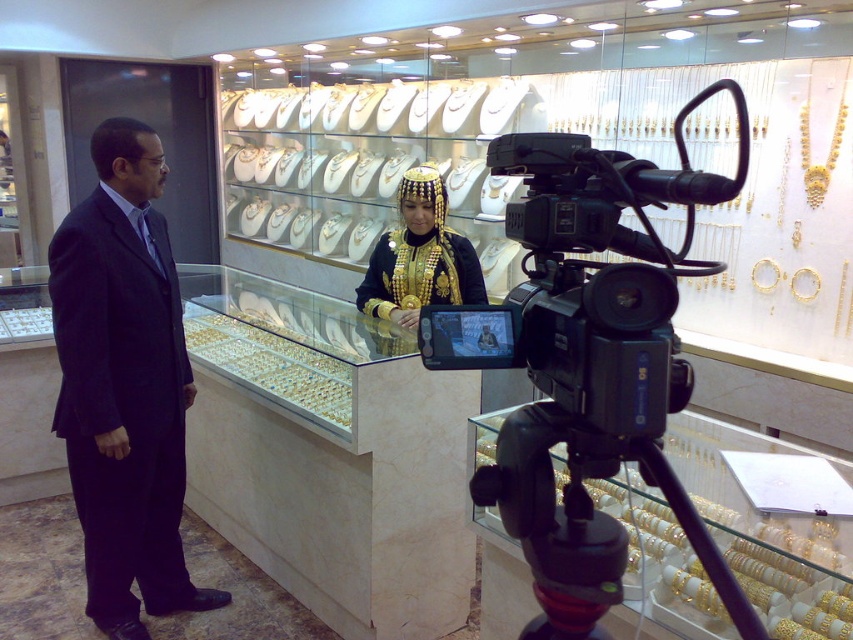
Question: Can you confirm if dark blue suit at left is wider than black plastic tripod at lower center?

Choices:
 (A) yes
 (B) no

Answer: (A)

Question: Among these objects, which one is nearest to the camera?

Choices:
 (A) black plastic tripod at lower center
 (B) dark blue suit at left

Answer: (A)

Question: Is dark blue suit at left in front of black plastic tripod at lower center?

Choices:
 (A) yes
 (B) no

Answer: (B)

Question: Which object appears closest to the camera in this image?

Choices:
 (A) black plastic tripod at lower center
 (B) black plastic video camera at center

Answer: (B)

Question: Estimate the real-world distances between objects in this image. Which object is farther from the black plastic video camera at center?

Choices:
 (A) dark blue suit at left
 (B) black plastic tripod at lower center

Answer: (A)

Question: Does black plastic video camera at center appear on the left side of dark blue suit at left?

Choices:
 (A) no
 (B) yes

Answer: (A)